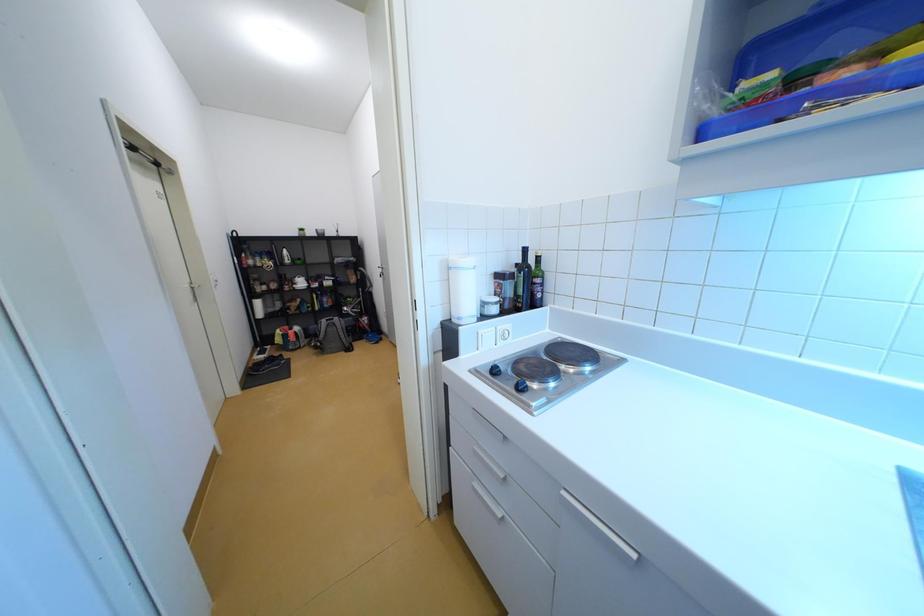
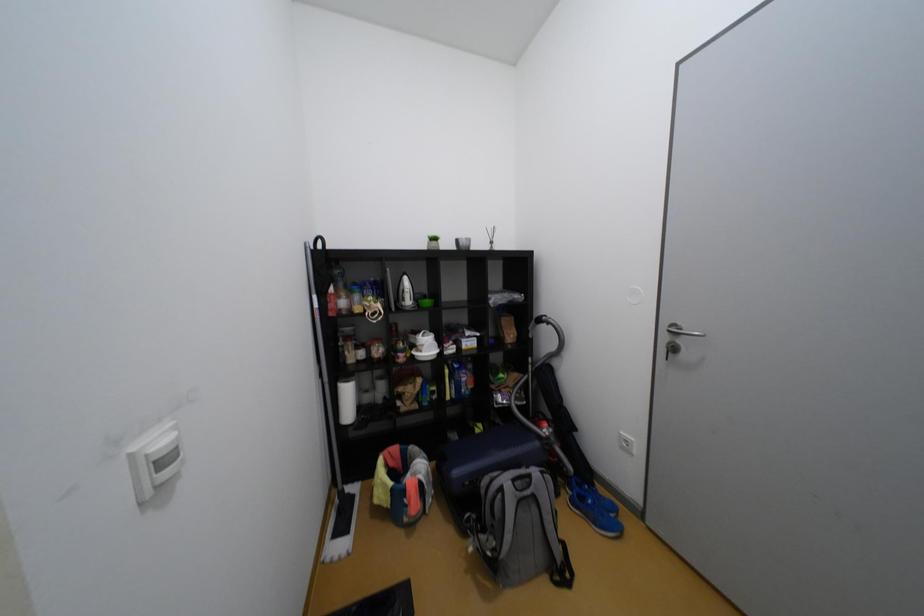
What movement of the cameraman would produce the second image?

The cameraman walked toward left, forward.